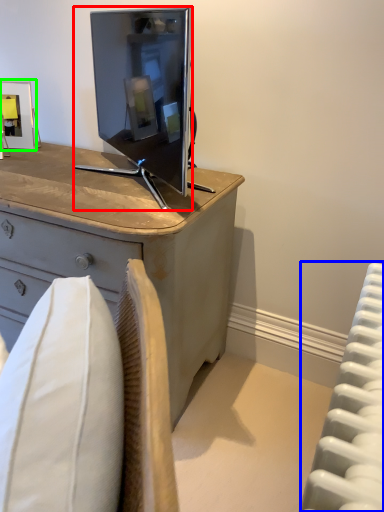
Question: Estimate the real-world distances between objects in this image. Which object is closer to television (highlighted by a red box), radiator (highlighted by a blue box) or picture frame (highlighted by a green box)?

Choices:
 (A) radiator
 (B) picture frame

Answer: (B)